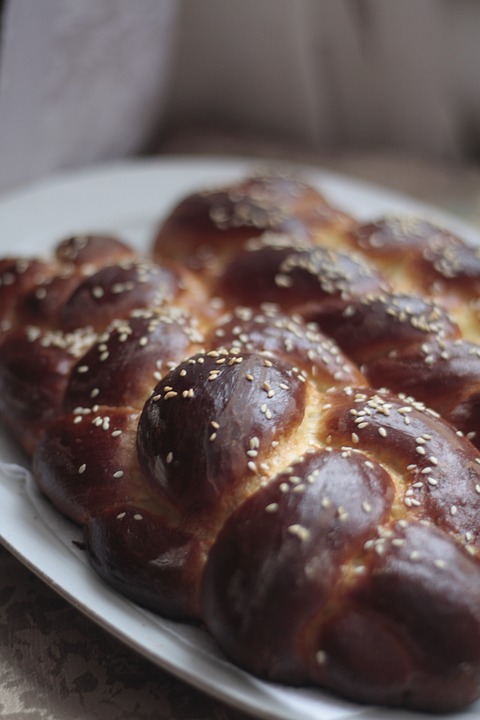
The width and height of the screenshot is (480, 720). I want to click on plate, so click(59, 575).